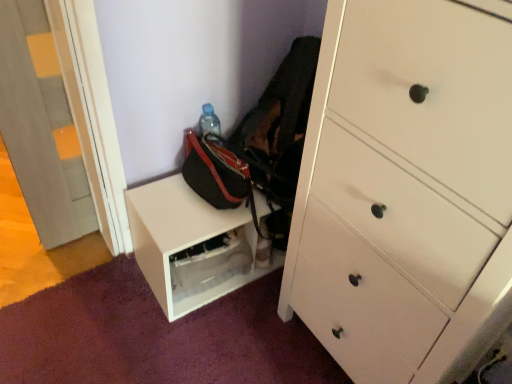
Identify the location of vacant space to the left of matte gray door at left. This screenshot has width=512, height=384. (23, 248).